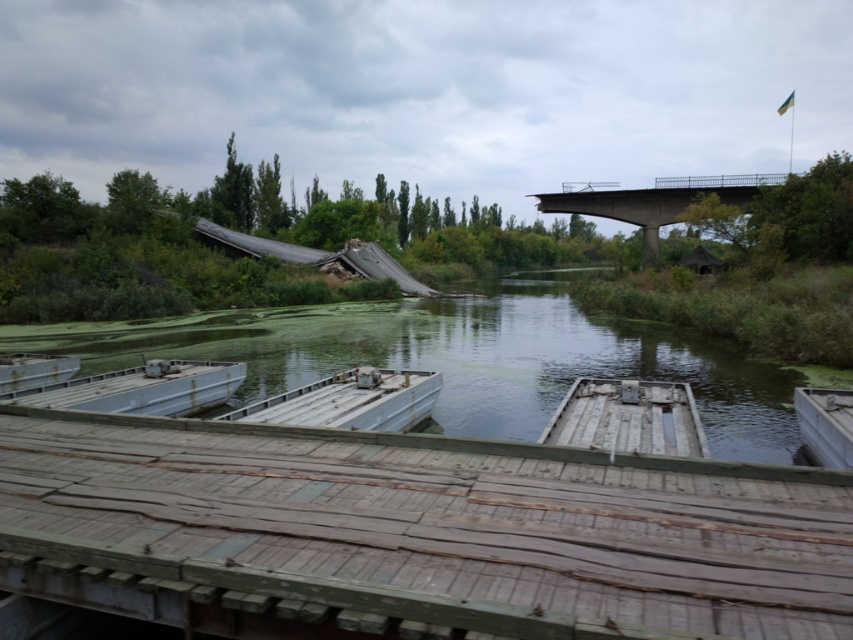
Question: Estimate the real-world distances between objects in this image. Which object is closer to the rusty metal boat at center?

Choices:
 (A) concrete bridge at upper right
 (B) green algae water at center

Answer: (B)

Question: Can you confirm if weathered wood dock at center is positioned to the left of green algae water at center?

Choices:
 (A) yes
 (B) no

Answer: (B)

Question: Which point is farther to the camera?

Choices:
 (A) [218, 392]
 (B) [741, 609]
 (C) [675, 192]
 (D) [115, 333]

Answer: (C)

Question: Is green algae water at center smaller than white matte boat at center?

Choices:
 (A) no
 (B) yes

Answer: (A)

Question: In this image, where is weathered wood dock at center located relative to metallic gray boat at center?

Choices:
 (A) below
 (B) above

Answer: (A)

Question: Which of these objects is positioned closest to the concrete bridge at upper right?

Choices:
 (A) green algae water at center
 (B) metallic gray boat at center
 (C) rusty metal boat at center
 (D) weathered wood dock at center

Answer: (A)